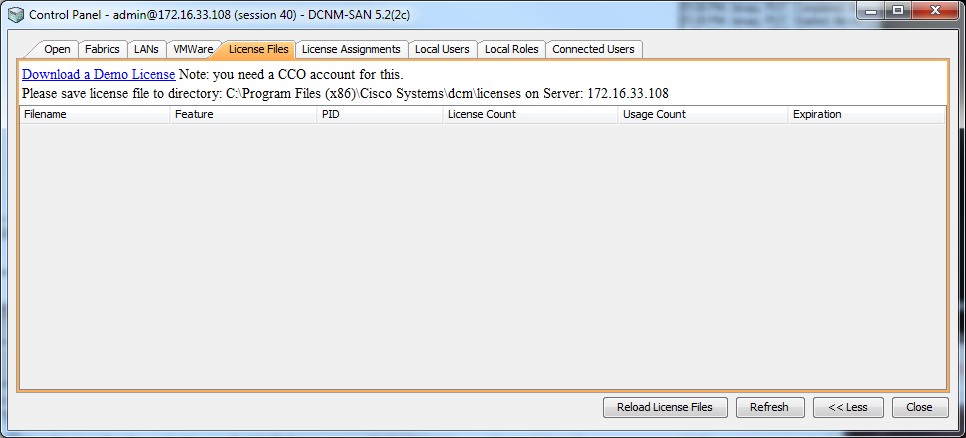
Identify the location of panel. Image resolution: width=966 pixels, height=438 pixels. (75, 19).